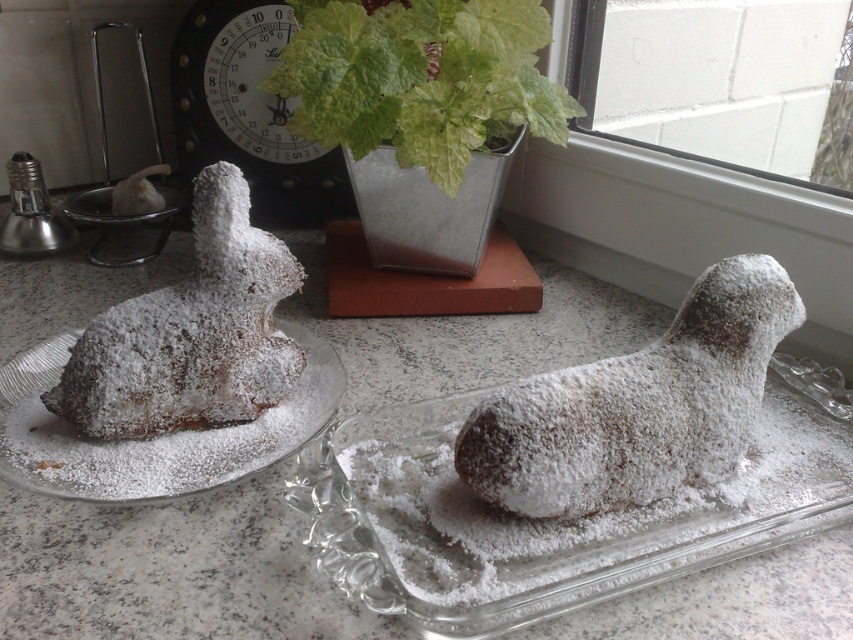
Question: Which object appears closest to the camera in this image?

Choices:
 (A) powdered sugar pastry at left
 (B) powdered sugar bunny at left
 (C) powdered sugar-coated lamb at center

Answer: (C)

Question: Estimate the real-world distances between objects in this image. Which object is closer to the powdered sugar bunny at left?

Choices:
 (A) powdered sugar pastry at left
 (B) powdered sugar-coated lamb at center

Answer: (A)

Question: Does powdered sugar-coated lamb at center appear under powdered sugar bunny at left?

Choices:
 (A) no
 (B) yes

Answer: (B)

Question: Which object is closer to the camera taking this photo?

Choices:
 (A) powdered sugar pastry at left
 (B) powdered sugar bunny at left
 (C) powdered sugar-coated lamb at center

Answer: (C)

Question: Can you confirm if powdered sugar bunny at left is positioned to the right of powdered sugar pastry at left?

Choices:
 (A) yes
 (B) no

Answer: (A)

Question: Is powdered sugar-coated lamb at center smaller than powdered sugar bunny at left?

Choices:
 (A) yes
 (B) no

Answer: (B)